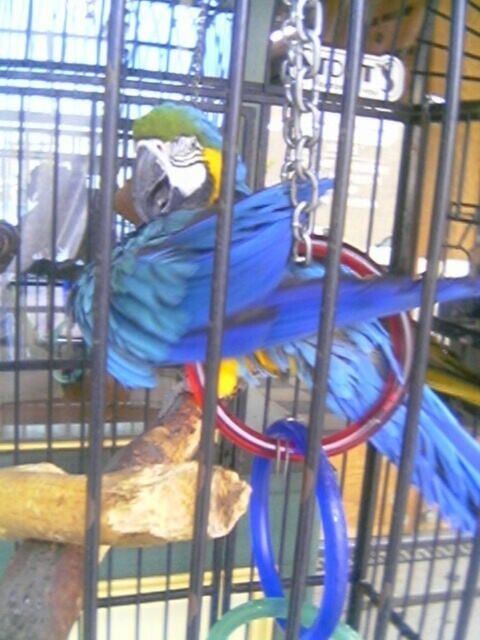
Where is the blue glossy parrot at center located in the image?

The blue glossy parrot at center is located at the point with coordinates 0.386 on the x axis and 0.344 on the y axis.

You are a photographer standing at a safe distance from the blue glossy parrot at center. You want to take a closeup photo without getting too close. Considering the distance between you and the bird, what is the minimum focal length lens you should use if your camera sensor is 36mm wide?

The minimum focal length lens required would be calculated using the formula focal length equals sensor width multiplied by distance divided by subject size. However, since the exact subject size isn not provided, it is not possible to determine the exact focal length needed. However, knowing that the photographer and the blue glossy parrot at center are 24.60 inches apart, a longer focal length lens would be necessary to achieve a closeup without moving closer.